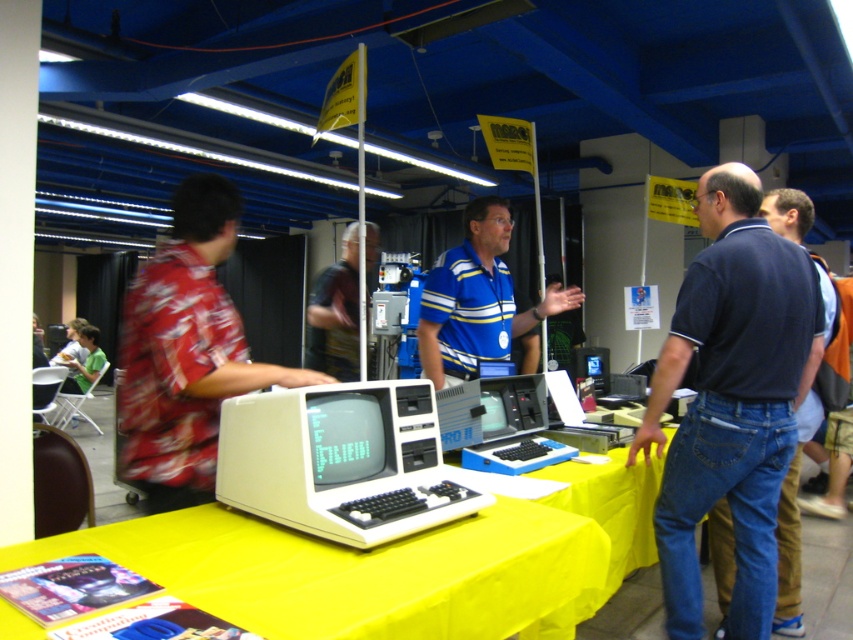
Which of these two, blue striped shirt at center or matte black laptop at center, stands shorter?

Standing shorter between the two is matte black laptop at center.

Is the position of blue striped shirt at center less distant than that of matte black laptop at center?

Yes.

Which is behind, point (457, 259) or point (555, 372)?

Positioned behind is point (555, 372).

At what (x,y) coordinates should I click in order to perform the action: click on blue striped shirt at center. Please return your answer as a coordinate pair (x, y). This screenshot has height=640, width=853. Looking at the image, I should click on coord(477,300).

Which of these two, yellow fabric table at center or floral fabric shirt at center, stands shorter?

yellow fabric table at center is shorter.

Between point (524, 580) and point (312, 360), which one is positioned in front?

Point (524, 580)

Which is behind, point (526, 628) or point (357, 225)?

The point (357, 225) is more distant.

Find the location of a particular element. This screenshot has width=853, height=640. yellow fabric table at center is located at coordinates (515, 557).

Which of these two, dark blue cotton shirt at right or white plastic computer at center, stands taller?

Standing taller between the two is dark blue cotton shirt at right.

Where is `dark blue cotton shirt at right`? The width and height of the screenshot is (853, 640). dark blue cotton shirt at right is located at coordinates (730, 400).